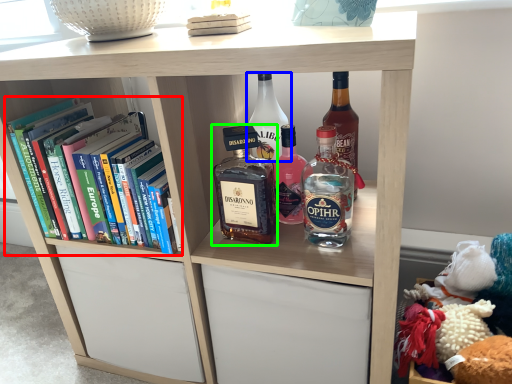
Question: Based on their relative distances, which object is farther from book (highlighted by a red box)? Choose from bottle (highlighted by a blue box) and bottle (highlighted by a green box).

Choices:
 (A) bottle
 (B) bottle

Answer: (A)